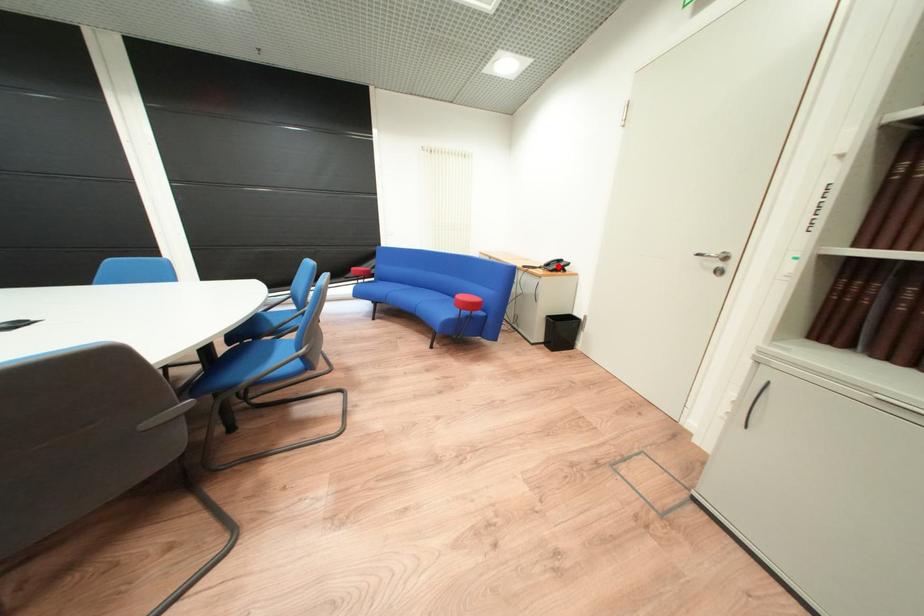
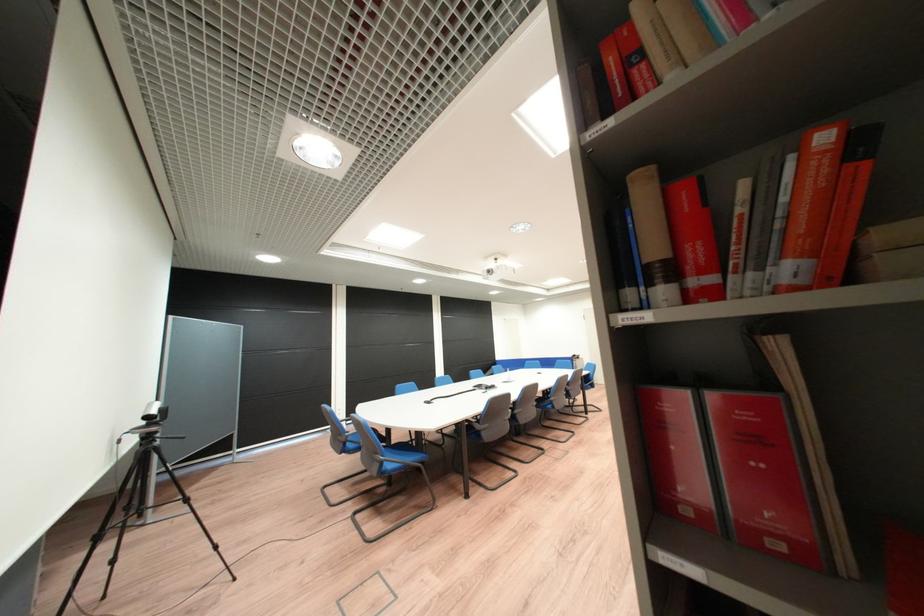
Question: I am providing you with two images of the same scene from different viewpoints. A red point is marked on the first image. At the location where the point appears in image 1, is it still visible in image 2?

Choices:
 (A) Yes
 (B) No

Answer: (B)